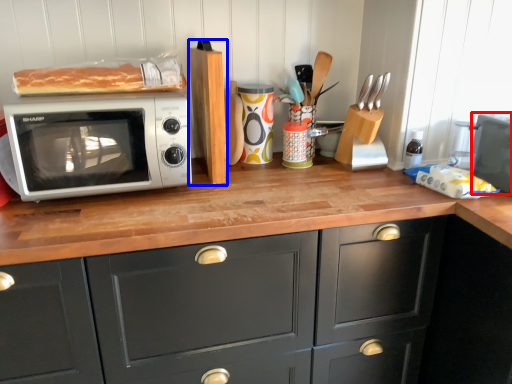
Question: Which point is further to the camera, appliance (highlighted by a red box) or wood (highlighted by a blue box)?

Choices:
 (A) appliance
 (B) wood

Answer: (B)